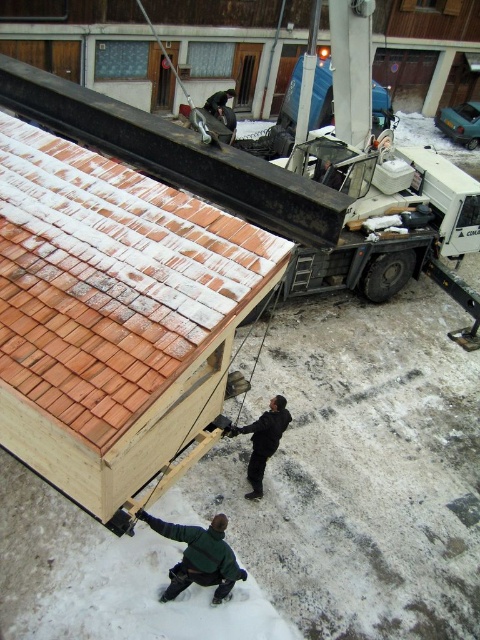
Question: Is green matte jacket at lower center further to the viewer compared to black matte jacket at center?

Choices:
 (A) no
 (B) yes

Answer: (A)

Question: Which object is farther from the camera taking this photo?

Choices:
 (A) green matte jacket at lower center
 (B) black matte jacket at center

Answer: (B)

Question: Which of the following is the farthest from the observer?

Choices:
 (A) brown shingles at upper left
 (B) green matte jacket at lower center

Answer: (B)

Question: From the image, what is the correct spatial relationship of green matte jacket at lower center in relation to black matte jacket at center?

Choices:
 (A) left
 (B) right

Answer: (A)

Question: Can you confirm if green matte jacket at lower center is smaller than black matte jacket at center?

Choices:
 (A) no
 (B) yes

Answer: (A)

Question: Which object appears farthest from the camera in this image?

Choices:
 (A) green matte jacket at lower center
 (B) brown shingles at upper left

Answer: (A)